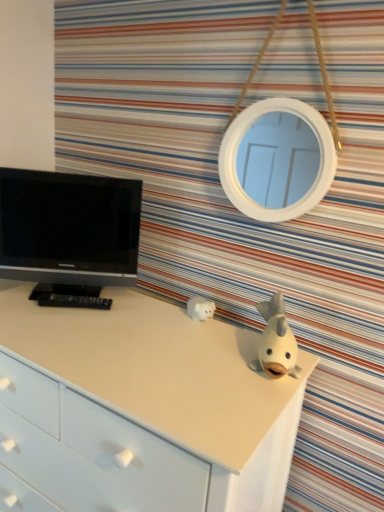
Question: Should I look upward or downward to see white matte piggy bank at center, the second toy from the right?

Choices:
 (A) up
 (B) down

Answer: (B)

Question: Does black glossy tv at left have a lesser height compared to white matte piggy bank at center, positioned as the second toy in front-to-back order?

Choices:
 (A) yes
 (B) no

Answer: (B)

Question: Considering the relative sizes of black glossy tv at left and white matte piggy bank at center, which is counted as the first toy, starting from the left, in the image provided, is black glossy tv at left smaller than white matte piggy bank at center, which is counted as the first toy, starting from the left,?

Choices:
 (A) no
 (B) yes

Answer: (A)

Question: Does black glossy tv at left have a greater width compared to white matte piggy bank at center, positioned as the second toy in front-to-back order?

Choices:
 (A) yes
 (B) no

Answer: (A)

Question: Is the depth of black glossy tv at left greater than that of white matte piggy bank at center, which is counted as the first toy, starting from the left?

Choices:
 (A) yes
 (B) no

Answer: (B)

Question: Does black glossy tv at left touch white matte piggy bank at center, the first toy from the back?

Choices:
 (A) yes
 (B) no

Answer: (B)

Question: Is black glossy tv at left to the right of white matte piggy bank at center, which is counted as the first toy, starting from the left, from the viewer's perspective?

Choices:
 (A) yes
 (B) no

Answer: (B)

Question: Is white matte piggy bank at center, the second toy from the right, not close to black glossy tv at left?

Choices:
 (A) no
 (B) yes

Answer: (A)

Question: Is white matte piggy bank at center, which is counted as the first toy, starting from the left, next to black glossy tv at left and touching it?

Choices:
 (A) no
 (B) yes

Answer: (A)

Question: Could you tell me if white matte piggy bank at center, positioned as the second toy in front-to-back order, is facing black glossy tv at left?

Choices:
 (A) no
 (B) yes

Answer: (A)

Question: Is white matte piggy bank at center, the second toy from the right, to the left of black glossy tv at left from the viewer's perspective?

Choices:
 (A) yes
 (B) no

Answer: (B)

Question: Considering the relative sizes of white matte piggy bank at center, which is counted as the first toy, starting from the left, and black glossy tv at left in the image provided, is white matte piggy bank at center, which is counted as the first toy, starting from the left, wider than black glossy tv at left?

Choices:
 (A) yes
 (B) no

Answer: (B)

Question: From the image's perspective, is white matte piggy bank at center, the second toy from the right, below black glossy tv at left?

Choices:
 (A) no
 (B) yes

Answer: (B)

Question: Is white matte chest of drawers at center not near white matte piggy bank at center, which is counted as the first toy, starting from the left?

Choices:
 (A) no
 (B) yes

Answer: (A)